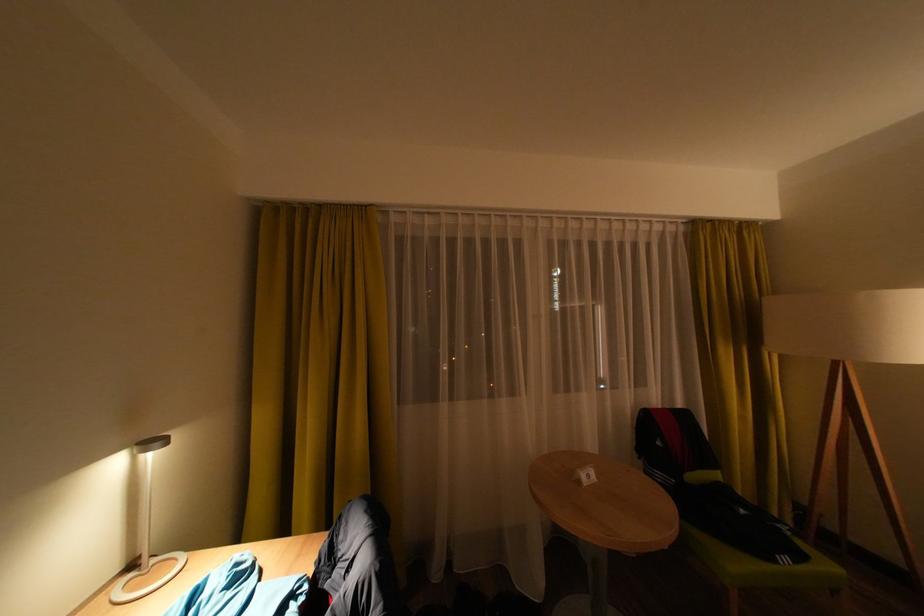
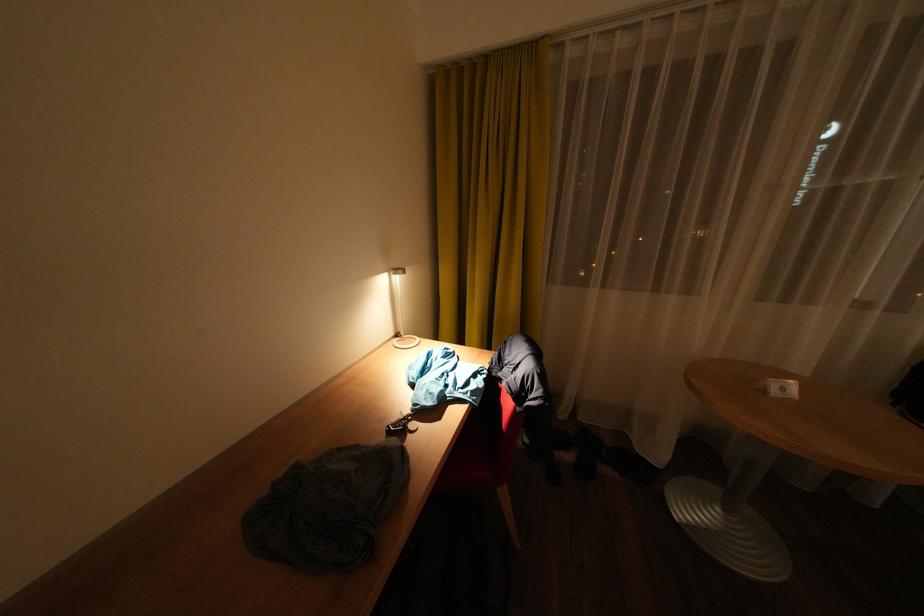
In the second image, find the point that corresponds to point (372, 209) in the first image.

(544, 47)